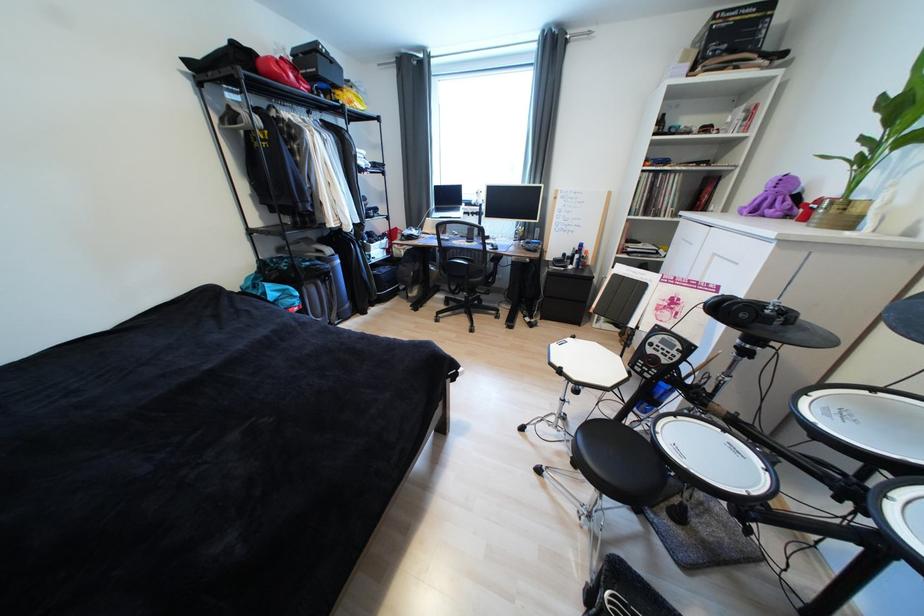
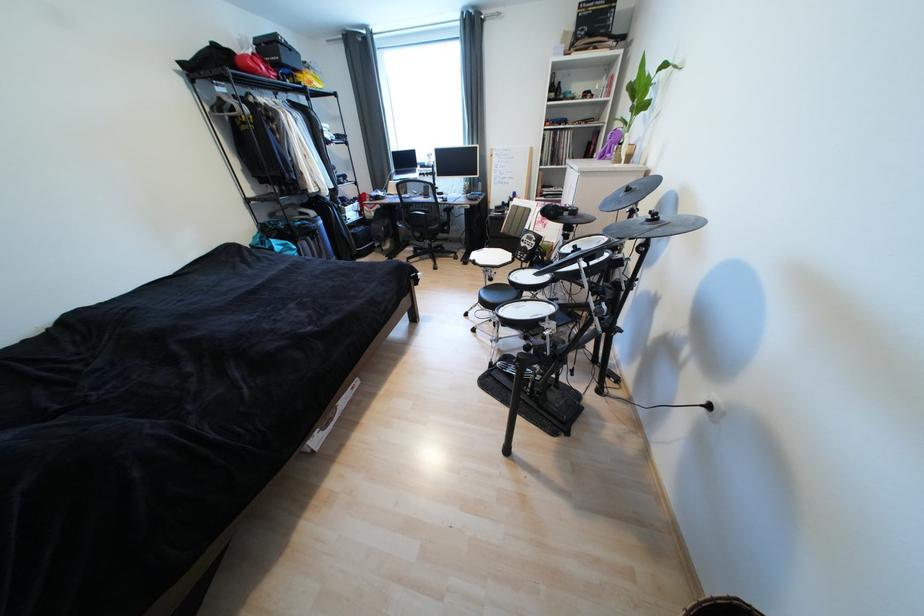
Where in the second image is the point corresponding to the point at 332,82 from the first image?

(294, 68)